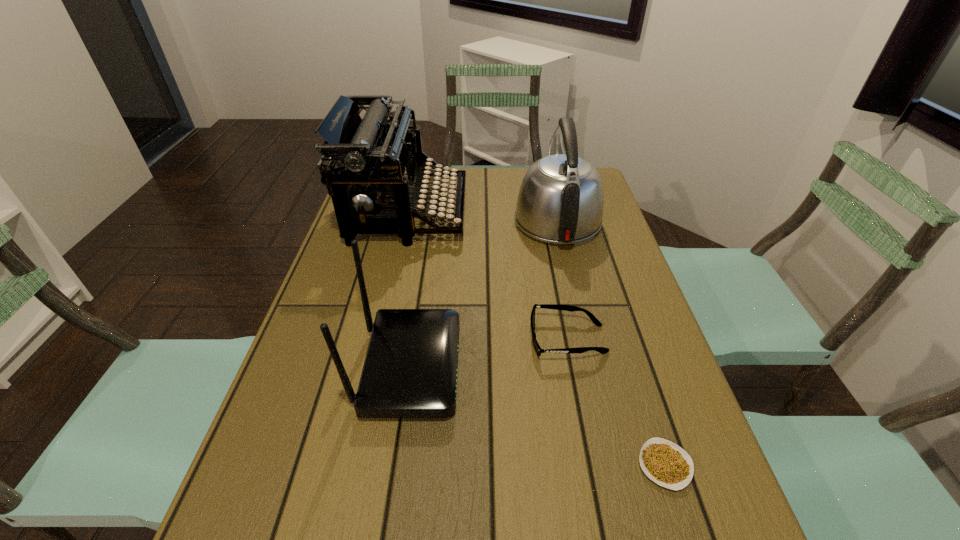
Image resolution: width=960 pixels, height=540 pixels. I want to click on vacant point located between the sunglasses and the kettle, so click(x=563, y=280).

Where is `free space that is in between the nearest object and the typewriter`? free space that is in between the nearest object and the typewriter is located at coordinates (537, 339).

Locate an element on the screen. This screenshot has width=960, height=540. free space that is in between the sunglasses and the kettle is located at coordinates (563, 280).

Find the location of a particular element. The image size is (960, 540). empty space that is in between the third tallest object and the nearest object is located at coordinates (538, 416).

Find the location of a particular element. The height and width of the screenshot is (540, 960). blank region between the kettle and the nearest object is located at coordinates (611, 343).

The height and width of the screenshot is (540, 960). In order to click on free spot between the router and the typewriter in this screenshot , I will do `click(409, 289)`.

What are the coordinates of `object that ranks as the closest to the legume` in the screenshot? It's located at (602, 350).

Where is `object that is the closest to the legume`? object that is the closest to the legume is located at coordinates (602, 350).

I want to click on blank area in the image that satisfies the following two spatial constraints: 1. on the typing side of the typewriter; 2. on the spout of the kettle, so click(x=406, y=220).

The width and height of the screenshot is (960, 540). Find the location of `vacant point that satisfies the following two spatial constraints: 1. on the back side of the shortest object; 2. on the front-facing side of the second shortest object`. vacant point that satisfies the following two spatial constraints: 1. on the back side of the shortest object; 2. on the front-facing side of the second shortest object is located at coordinates (624, 339).